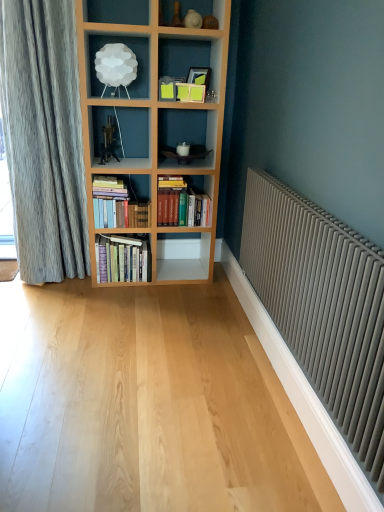
What are the coordinates of `free spot in front of hardcover books at center, the third book positioned from the right` in the screenshot? It's located at (115, 298).